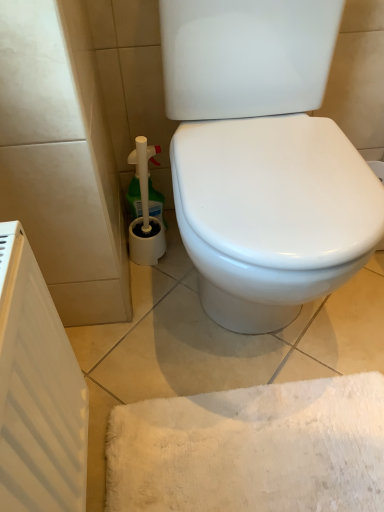
Identify the location of white matte radiator at left. (37, 391).

In order to face white matte radiator at left, should I rotate leftwards or rightwards?

Rotate your view left by about 17.782°.

This screenshot has width=384, height=512. Describe the element at coordinates (37, 391) in the screenshot. I see `white matte radiator at left` at that location.

What are the coordinates of `green plastic cleaner at lower left` in the screenshot? It's located at (145, 208).

The height and width of the screenshot is (512, 384). What do you see at coordinates (145, 208) in the screenshot? I see `green plastic cleaner at lower left` at bounding box center [145, 208].

Identify the location of white matte radiator at left. (37, 391).

Is white matte radiator at left at the right side of green plastic cleaner at lower left?

In fact, white matte radiator at left is to the left of green plastic cleaner at lower left.

Which object is closer to the camera, white matte radiator at left or green plastic cleaner at lower left?

white matte radiator at left.

Which point is more distant from viewer, (67, 418) or (155, 148)?

The point (155, 148) is behind.

From the image's perspective, does white matte radiator at left appear lower than green plastic cleaner at lower left?

Yes.

From a real-world perspective, who is located higher, white matte radiator at left or green plastic cleaner at lower left?

In real-world perspective, white matte radiator at left is above.

Does white matte radiator at left have a lesser width compared to green plastic cleaner at lower left?

Correct, the width of white matte radiator at left is less than that of green plastic cleaner at lower left.

Considering the relative sizes of white matte radiator at left and green plastic cleaner at lower left in the image provided, is white matte radiator at left taller than green plastic cleaner at lower left?

Correct, white matte radiator at left is much taller as green plastic cleaner at lower left.

Which of these two, white matte radiator at left or green plastic cleaner at lower left, is bigger?

Bigger between the two is white matte radiator at left.

Is white matte radiator at left spatially inside green plastic cleaner at lower left, or outside of it?

white matte radiator at left is not inside green plastic cleaner at lower left, it's outside.

Does white matte radiator at left touch green plastic cleaner at lower left?

They are not placed beside each other.

Is green plastic cleaner at lower left at the back of white matte radiator at left?

white matte radiator at left does not have its back to green plastic cleaner at lower left.

How many degrees apart are the facing directions of white matte radiator at left and green plastic cleaner at lower left?

white matte radiator at left and green plastic cleaner at lower left are facing 89.1 degrees away from each other.

This screenshot has height=512, width=384. Identify the location of radiator above the green plastic cleaner at lower left (from a real-world perspective). (37, 391).

Based on their positions, is green plastic cleaner at lower left located to the left or right of white matte radiator at left?

Based on their positions, green plastic cleaner at lower left is located to the right of white matte radiator at left.

Is green plastic cleaner at lower left closer to camera compared to white matte radiator at left?

No, green plastic cleaner at lower left is further to the viewer.

Does point (137, 242) appear closer or farther from the camera than point (56, 403)?

Clearly, point (137, 242) is more distant from the camera than point (56, 403).

From the image's perspective, is green plastic cleaner at lower left on top of white matte radiator at left?

Correct, green plastic cleaner at lower left appears higher than white matte radiator at left in the image.

From a real-world perspective, is green plastic cleaner at lower left positioned under white matte radiator at left based on gravity?

Yes, from a real-world perspective, green plastic cleaner at lower left is under white matte radiator at left.

Looking at their sizes, would you say green plastic cleaner at lower left is wider or thinner than white matte radiator at left?

Considering their sizes, green plastic cleaner at lower left looks broader than white matte radiator at left.

Who is shorter, green plastic cleaner at lower left or white matte radiator at left?

Standing shorter between the two is green plastic cleaner at lower left.

From the picture: Considering the sizes of objects green plastic cleaner at lower left and white matte radiator at left in the image provided, who is smaller, green plastic cleaner at lower left or white matte radiator at left?

green plastic cleaner at lower left.

Is white matte radiator at left inside green plastic cleaner at lower left?

No.

In the scene shown: Are green plastic cleaner at lower left and white matte radiator at left beside each other?

No, green plastic cleaner at lower left is not with white matte radiator at left.

Is green plastic cleaner at lower left aimed at white matte radiator at left?

No.

Identify the location of cleaning product below the white matte radiator at left (from a real-world perspective). This screenshot has height=512, width=384. coord(145,208).

Locate an element on the screen. The width and height of the screenshot is (384, 512). cleaning product above the white matte radiator at left (from the image's perspective) is located at coordinates (145, 208).

Where is `cleaning product below the white matte radiator at left (from a real-world perspective)`? cleaning product below the white matte radiator at left (from a real-world perspective) is located at coordinates (145, 208).